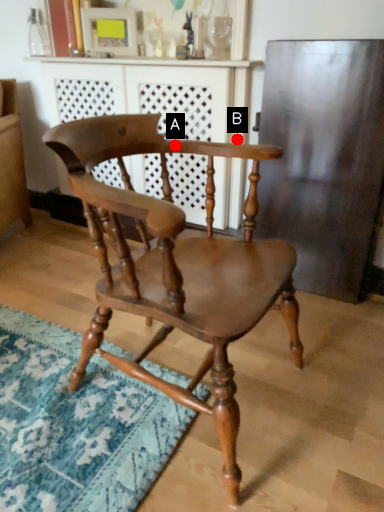
Question: Two points are circled on the image, labeled by A and B beside each circle. Which point is closer to the camera?

Choices:
 (A) A is closer
 (B) B is closer

Answer: (A)